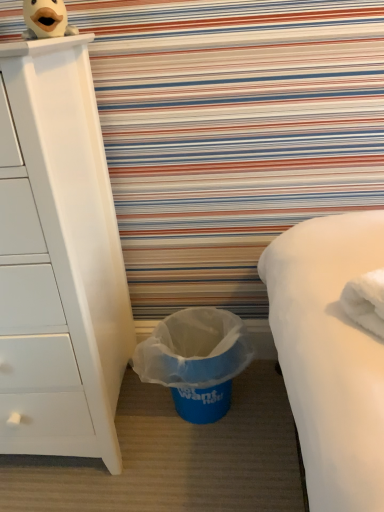
Question: From the image's perspective, is white matte chest of drawers at left over blue plastic trash can at lower center?

Choices:
 (A) yes
 (B) no

Answer: (A)

Question: Can you see white matte chest of drawers at left touching blue plastic trash can at lower center?

Choices:
 (A) yes
 (B) no

Answer: (B)

Question: Could you tell me if white matte chest of drawers at left is turned towards blue plastic trash can at lower center?

Choices:
 (A) yes
 (B) no

Answer: (B)

Question: Is blue plastic trash can at lower center completely or partially inside white matte chest of drawers at left?

Choices:
 (A) yes
 (B) no

Answer: (B)

Question: Is white matte chest of drawers at left behind blue plastic trash can at lower center?

Choices:
 (A) yes
 (B) no

Answer: (B)

Question: Considering the relative sizes of white matte chest of drawers at left and blue plastic trash can at lower center in the image provided, is white matte chest of drawers at left wider than blue plastic trash can at lower center?

Choices:
 (A) no
 (B) yes

Answer: (B)

Question: Does blue plastic trash can at lower center appear on the right side of white matte chest of drawers at left?

Choices:
 (A) yes
 (B) no

Answer: (A)

Question: From a real-world perspective, does blue plastic trash can at lower center sit lower than white matte chest of drawers at left?

Choices:
 (A) yes
 (B) no

Answer: (A)

Question: Does blue plastic trash can at lower center have a lesser width compared to white matte chest of drawers at left?

Choices:
 (A) yes
 (B) no

Answer: (A)

Question: Is blue plastic trash can at lower center oriented away from white matte chest of drawers at left?

Choices:
 (A) no
 (B) yes

Answer: (A)

Question: Can you confirm if blue plastic trash can at lower center is bigger than white matte chest of drawers at left?

Choices:
 (A) no
 (B) yes

Answer: (A)

Question: From the image's perspective, is blue plastic trash can at lower center over white matte chest of drawers at left?

Choices:
 (A) no
 (B) yes

Answer: (A)

Question: Is plush duck at upper left next to blue plastic trash can at lower center and touching it?

Choices:
 (A) no
 (B) yes

Answer: (A)